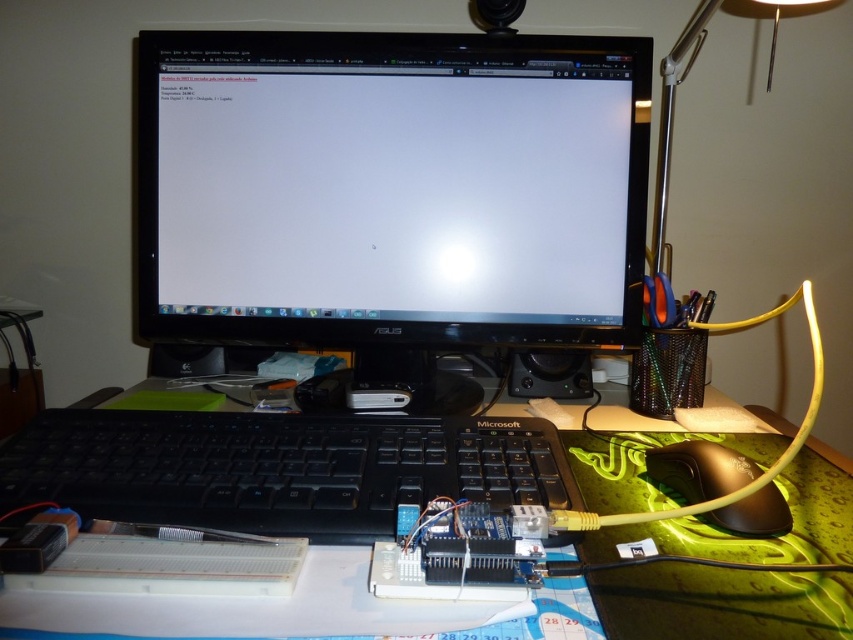
You are organizing your desk and want to place a new item between the black plastic keyboard at center and the black plastic mouse at lower right. Based on their positions, which object is closer to you so you can decide where to place the new item?

The black plastic keyboard at center is closer to the viewer than the black plastic mouse at lower right, so you should place the new item between them by positioning it near the mouse to maintain proximity order.

Based on the photo, you are organizing your desk and want to place a new item between the black plastic keyboard at center and the black plastic mouse at lower right. Based on their positions, where should you place the new item?

The black plastic keyboard at center is above the black plastic mouse at lower right, so you should place the new item between them in the vertical space below the keyboard and above the mouse.

You are organizing your desk and want to place both the black plastic keyboard at center and the black plastic mouse at lower right into a storage box. The box can only fit items that are smaller than 15 inches in length. Based on the description, will both items fit?

The black plastic keyboard at center is larger in size than the black plastic mouse at lower right. Since the keyboard is larger, if it exceeds 15 inches in length, it won not fit. However, the mouse is smaller and would fit. Without exact measurements, we can only confirm the mouse will fit, but the keyboard might not.